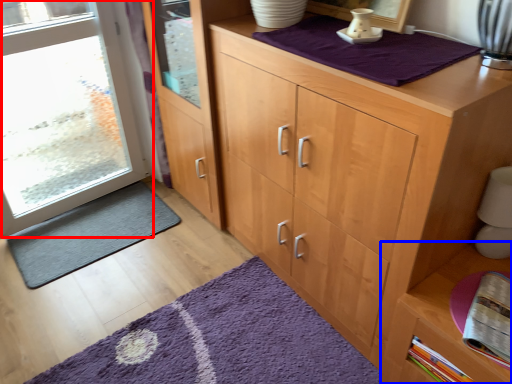
Question: Which of the following is the closest to the observer, door (highlighted by a red box) or cabinetry (highlighted by a blue box)?

Choices:
 (A) door
 (B) cabinetry

Answer: (B)